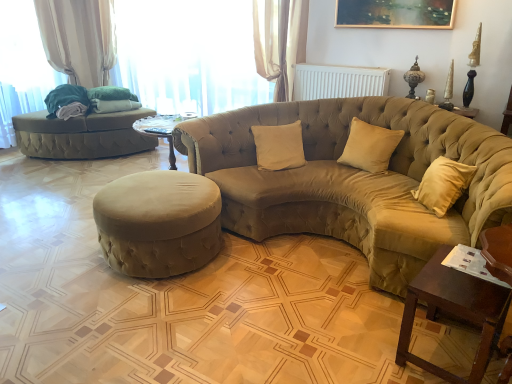
Question: Considering the positions of velvet beige studio couch at center, which is the 2th studio couch in back-to-front order, and wooden table at lower right in the image, is velvet beige studio couch at center, which is the 2th studio couch in back-to-front order, bigger or smaller than wooden table at lower right?

Choices:
 (A) small
 (B) big

Answer: (B)

Question: From a real-world perspective, relative to wooden table at lower right, is velvet beige studio couch at center, the 2th studio couch in the left-to-right sequence, vertically above or below?

Choices:
 (A) above
 (B) below

Answer: (A)

Question: Considering the real-world distances, which object is closest to the suede beige pillow at center, which ranks as the 2th pillow in left-to-right order?

Choices:
 (A) suede ottoman at center
 (B) wooden table at lower right
 (C) beige fabric curtain at upper center, the 2th curtain in the back-to-front sequence
 (D) sheer fabric curtain at upper center
 (E) beige fabric pillow at center, which is the first pillow in left-to-right order

Answer: (E)

Question: Which of these objects is positioned closest to the suede-like beige studio couch at left, the 1th studio couch when ordered from left to right?

Choices:
 (A) beige fabric curtain at upper center, which is counted as the first curtain, starting from the front
 (B) wooden table at lower right
 (C) white plastic radiator at upper center
 (D) suede beige pillow at center, which ranks as the 2th pillow in left-to-right order
 (E) sheer fabric curtain at upper center

Answer: (E)